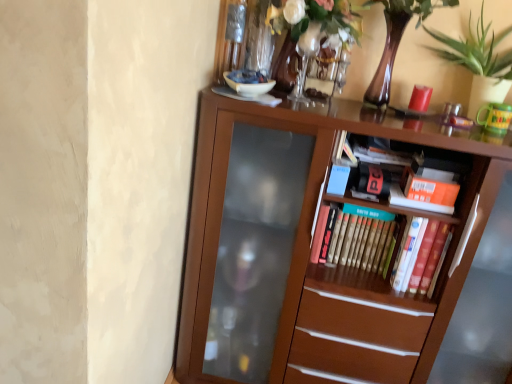
Question: Are green leafy plant at upper right and orange matte paperback book at upper right, arranged as the first paperback book when viewed from the right, located far from each other?

Choices:
 (A) no
 (B) yes

Answer: (A)

Question: From a real-world perspective, does green leafy plant at upper right sit lower than orange matte paperback book at upper right, which is counted as the third paperback book, starting from the left?

Choices:
 (A) yes
 (B) no

Answer: (B)

Question: Could you tell me if green leafy plant at upper right is facing orange matte paperback book at upper right, which is counted as the third paperback book, starting from the left?

Choices:
 (A) yes
 (B) no

Answer: (B)

Question: Does green leafy plant at upper right have a smaller size compared to orange matte paperback book at upper right, arranged as the first paperback book when viewed from the right?

Choices:
 (A) no
 (B) yes

Answer: (A)

Question: Is orange matte paperback book at upper right, which is counted as the third paperback book, starting from the left, at the back of green leafy plant at upper right?

Choices:
 (A) yes
 (B) no

Answer: (B)

Question: Does green leafy plant at upper right have a greater height compared to orange matte paperback book at upper right, arranged as the first paperback book when viewed from the right?

Choices:
 (A) yes
 (B) no

Answer: (A)

Question: From the image's perspective, is hardcover book at center, which is counted as the 1th paperback book, starting from the left, over orange matte paperback book at upper right, which is counted as the third paperback book, starting from the left?

Choices:
 (A) yes
 (B) no

Answer: (B)

Question: From a real-world perspective, does hardcover book at center, which appears as the 3th paperback book when viewed from the right, stand above orange matte paperback book at upper right, which is counted as the third paperback book, starting from the left?

Choices:
 (A) yes
 (B) no

Answer: (B)

Question: Does hardcover book at center, which appears as the 3th paperback book when viewed from the right, have a lesser height compared to orange matte paperback book at upper right, which is counted as the third paperback book, starting from the left?

Choices:
 (A) no
 (B) yes

Answer: (A)

Question: Can you confirm if hardcover book at center, which is counted as the 1th paperback book, starting from the left, is taller than orange matte paperback book at upper right, arranged as the first paperback book when viewed from the right?

Choices:
 (A) no
 (B) yes

Answer: (B)

Question: Is hardcover book at center, which is counted as the 1th paperback book, starting from the left, turned away from orange matte paperback book at upper right, arranged as the first paperback book when viewed from the right?

Choices:
 (A) yes
 (B) no

Answer: (B)

Question: Could orange matte paperback book at upper right, arranged as the first paperback book when viewed from the right, be considered to be inside hardcover book at center, which is counted as the 1th paperback book, starting from the left?

Choices:
 (A) yes
 (B) no

Answer: (B)

Question: Can we say hardcover book at center, which appears as the 3th paperback book when viewed from the right, lies outside brown wooden bookcase at center?

Choices:
 (A) yes
 (B) no

Answer: (B)